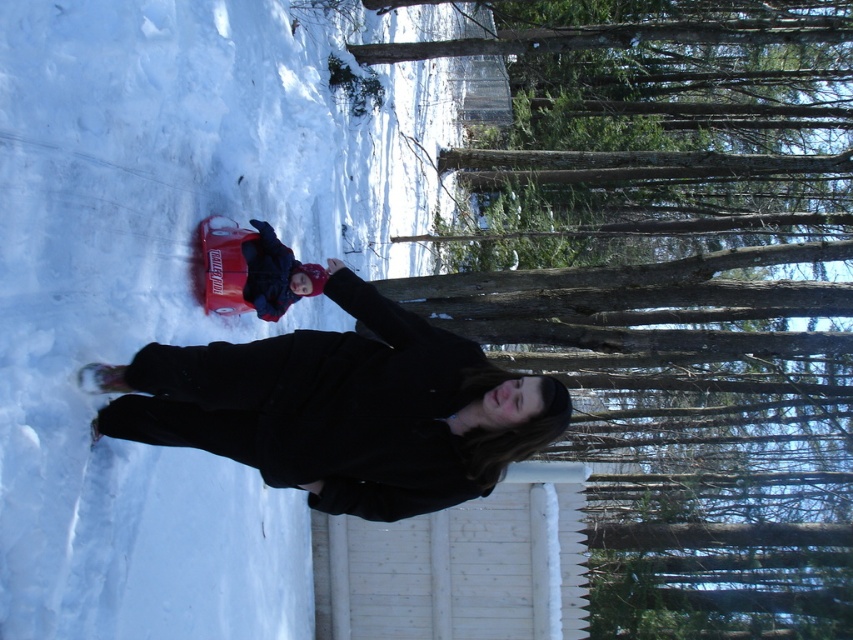
Question: Which point is closer to the camera?

Choices:
 (A) click(x=248, y=472)
 (B) click(x=380, y=388)

Answer: (B)

Question: Is white fluffy snow at center wider than black woolen coat at center?

Choices:
 (A) no
 (B) yes

Answer: (A)

Question: Is white fluffy snow at center bigger than black woolen coat at center?

Choices:
 (A) no
 (B) yes

Answer: (B)

Question: Does white fluffy snow at center appear on the right side of black woolen coat at center?

Choices:
 (A) no
 (B) yes

Answer: (A)